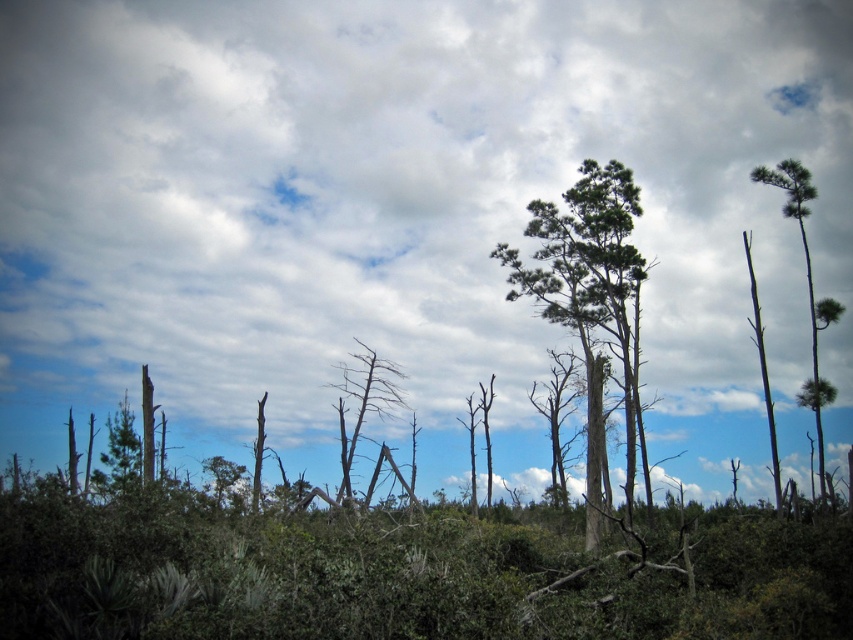
Question: Which object is closer to the camera taking this photo?

Choices:
 (A) green textured pine tree at upper right
 (B) cloudy sky at upper center

Answer: (A)

Question: Does green textured pine trees at center come behind bare wood tree at center?

Choices:
 (A) yes
 (B) no

Answer: (B)

Question: Which is farther from the green textured pine tree at upper right?

Choices:
 (A) cloudy sky at upper center
 (B) bare wood tree at center
 (C) green textured pine trees at center

Answer: (B)

Question: Observing the image, what is the correct spatial positioning of cloudy sky at upper center in reference to bare wood tree at center?

Choices:
 (A) left
 (B) right

Answer: (B)

Question: Among these objects, which one is farthest from the camera?

Choices:
 (A) bare wood tree at center
 (B) green textured pine trees at center

Answer: (A)

Question: Does cloudy sky at upper center appear on the left side of green textured pine tree at upper right?

Choices:
 (A) no
 (B) yes

Answer: (B)